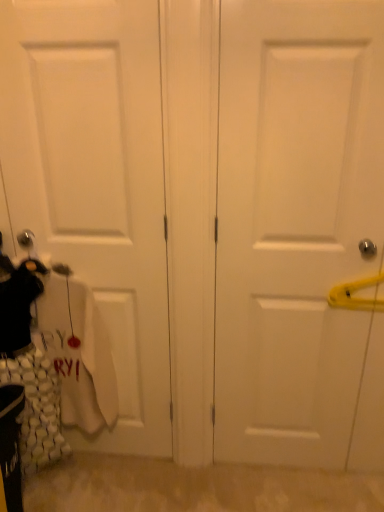
What do you see at coordinates (96, 184) in the screenshot? I see `white matte door at left, placed as the 2th door when sorted from right to left` at bounding box center [96, 184].

Identify the location of white matte door at left, the first door in the left-to-right sequence. (96, 184).

This screenshot has height=512, width=384. What do you see at coordinates (295, 224) in the screenshot?
I see `white matte door at right, which is the 1th door from right to left` at bounding box center [295, 224].

Where is `white matte door at right, marked as the second door in a left-to-right arrangement`? Image resolution: width=384 pixels, height=512 pixels. white matte door at right, marked as the second door in a left-to-right arrangement is located at coordinates (295, 224).

Where is `white matte door at left, placed as the 2th door when sorted from right to left`? white matte door at left, placed as the 2th door when sorted from right to left is located at coordinates (96, 184).

Is white matte door at right, marked as the second door in a left-to-right arrangement, at the right side of white matte door at left, placed as the 2th door when sorted from right to left?

Yes, white matte door at right, marked as the second door in a left-to-right arrangement, is to the right of white matte door at left, placed as the 2th door when sorted from right to left.

Who is more distant, white matte door at right, marked as the second door in a left-to-right arrangement, or white matte door at left, the first door in the left-to-right sequence?

white matte door at left, the first door in the left-to-right sequence, is more distant.

Does point (264, 278) come closer to viewer compared to point (99, 66)?

That is False.

From the image's perspective, between white matte door at right, marked as the second door in a left-to-right arrangement, and white matte door at left, placed as the 2th door when sorted from right to left, who is located below?

white matte door at right, marked as the second door in a left-to-right arrangement.

From a real-world perspective, is white matte door at right, which is the 1th door from right to left, above or below white matte door at left, placed as the 2th door when sorted from right to left?

white matte door at right, which is the 1th door from right to left, is below white matte door at left, placed as the 2th door when sorted from right to left.

Considering the sizes of objects white matte door at right, which is the 1th door from right to left, and white matte door at left, the first door in the left-to-right sequence, in the image provided, who is wider, white matte door at right, which is the 1th door from right to left, or white matte door at left, the first door in the left-to-right sequence,?

Wider between the two is white matte door at right, which is the 1th door from right to left.

Between white matte door at right, marked as the second door in a left-to-right arrangement, and white matte door at left, placed as the 2th door when sorted from right to left, which one has less height?

With less height is white matte door at right, marked as the second door in a left-to-right arrangement.

Considering the sizes of objects white matte door at right, marked as the second door in a left-to-right arrangement, and white matte door at left, the first door in the left-to-right sequence, in the image provided, who is bigger, white matte door at right, marked as the second door in a left-to-right arrangement, or white matte door at left, the first door in the left-to-right sequence,?

white matte door at right, marked as the second door in a left-to-right arrangement, is bigger.

Is white matte door at right, which is the 1th door from right to left, not inside white matte door at left, placed as the 2th door when sorted from right to left?

white matte door at right, which is the 1th door from right to left, is positioned outside white matte door at left, placed as the 2th door when sorted from right to left.

Is white matte door at right, which is the 1th door from right to left, placed right next to white matte door at left, the first door in the left-to-right sequence?

No, white matte door at right, which is the 1th door from right to left, is not making contact with white matte door at left, the first door in the left-to-right sequence.

Is white matte door at right, marked as the second door in a left-to-right arrangement, facing away from white matte door at left, the first door in the left-to-right sequence?

white matte door at right, marked as the second door in a left-to-right arrangement, is not turned away from white matte door at left, the first door in the left-to-right sequence.

How much distance is there between white matte door at right, which is the 1th door from right to left, and white matte door at left, placed as the 2th door when sorted from right to left?

A distance of 16.61 inches exists between white matte door at right, which is the 1th door from right to left, and white matte door at left, placed as the 2th door when sorted from right to left.

The image size is (384, 512). I want to click on door that appears in front of the white matte door at left, the first door in the left-to-right sequence, so click(295, 224).

Which object is positioned more to the right, white matte door at left, placed as the 2th door when sorted from right to left, or white matte door at right, marked as the second door in a left-to-right arrangement?

white matte door at right, marked as the second door in a left-to-right arrangement.

Which object is more forward, white matte door at left, the first door in the left-to-right sequence, or white matte door at right, marked as the second door in a left-to-right arrangement?

Positioned in front is white matte door at right, marked as the second door in a left-to-right arrangement.

Is point (33, 54) positioned before point (316, 413)?

Yes, point (33, 54) is in front of point (316, 413).

From the image's perspective, which object appears higher, white matte door at left, placed as the 2th door when sorted from right to left, or white matte door at right, marked as the second door in a left-to-right arrangement?

white matte door at left, placed as the 2th door when sorted from right to left, is shown above in the image.

From the picture: From a real-world perspective, is white matte door at left, placed as the 2th door when sorted from right to left, below white matte door at right, marked as the second door in a left-to-right arrangement?

No.

Consider the image. Between white matte door at left, placed as the 2th door when sorted from right to left, and white matte door at right, which is the 1th door from right to left, which one has smaller width?

With smaller width is white matte door at left, placed as the 2th door when sorted from right to left.

Considering the sizes of objects white matte door at left, the first door in the left-to-right sequence, and white matte door at right, marked as the second door in a left-to-right arrangement, in the image provided, who is taller, white matte door at left, the first door in the left-to-right sequence, or white matte door at right, marked as the second door in a left-to-right arrangement,?

white matte door at left, the first door in the left-to-right sequence.

Considering the relative sizes of white matte door at left, placed as the 2th door when sorted from right to left, and white matte door at right, marked as the second door in a left-to-right arrangement, in the image provided, is white matte door at left, placed as the 2th door when sorted from right to left, smaller than white matte door at right, marked as the second door in a left-to-right arrangement,?

Correct, white matte door at left, placed as the 2th door when sorted from right to left, occupies less space than white matte door at right, marked as the second door in a left-to-right arrangement.

Based on the photo, would you say white matte door at left, placed as the 2th door when sorted from right to left, is inside or outside white matte door at right, which is the 1th door from right to left?

white matte door at left, placed as the 2th door when sorted from right to left, lies outside white matte door at right, which is the 1th door from right to left.

Is white matte door at left, placed as the 2th door when sorted from right to left, in contact with white matte door at right, which is the 1th door from right to left?

white matte door at left, placed as the 2th door when sorted from right to left, and white matte door at right, which is the 1th door from right to left, are not in contact.

Is white matte door at left, the first door in the left-to-right sequence, looking in the opposite direction of white matte door at right, marked as the second door in a left-to-right arrangement?

No, white matte door at right, marked as the second door in a left-to-right arrangement, is not at the back of white matte door at left, the first door in the left-to-right sequence.

How different are the orientations of white matte door at left, the first door in the left-to-right sequence, and white matte door at right, marked as the second door in a left-to-right arrangement, in degrees?

0.00676 degrees.

The image size is (384, 512). I want to click on door located on the left of white matte door at right, which is the 1th door from right to left, so click(x=96, y=184).

I want to click on door above the white matte door at right, which is the 1th door from right to left (from a real-world perspective), so click(96, 184).

Locate an element on the screen. The image size is (384, 512). door that appears below the white matte door at left, the first door in the left-to-right sequence (from a real-world perspective) is located at coordinates (295, 224).